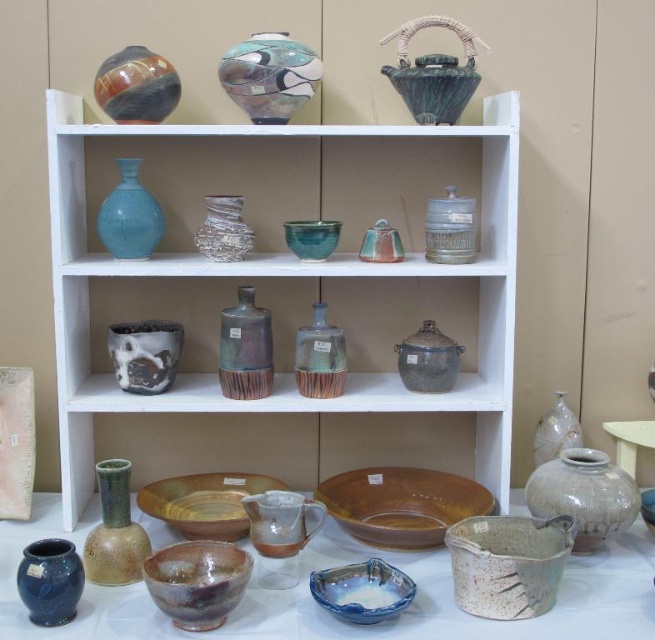
You are arranging a small centerpiece for a dinner party and have both the matte brown bowl at center and the matte brown plate at center available. Which item would be more suitable for holding a larger arrangement?

The matte brown plate at center is more suitable for holding a larger arrangement because it is larger in size compared to the matte brown bowl at center.

You have a small decorative item that needs to be placed on the shelf. The item is 10 cm in width. You see the matte brown bowl at center and the matte brown plate at center. Which object can the item fit next to without exceeding its width?

The small decorative item can fit next to the matte brown plate at center because the matte brown bowl at center has a lesser width compared to the matte brown plate at center, so the plate has more space around it.

You are an interior designer arranging items on a three tiered shelving unit. You have a translucent glass vase at upper center and a matte brown plate at center. According to the scene, which object is placed higher?

The translucent glass vase at upper center is positioned over the matte brown plate at center, so it is placed higher.